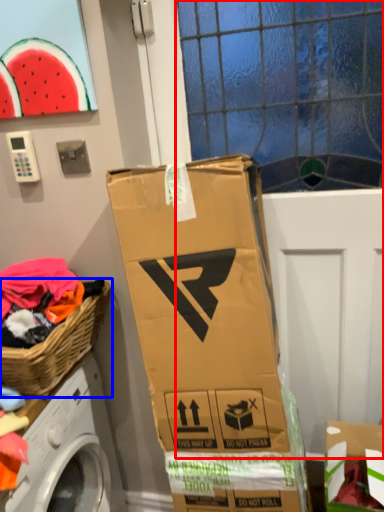
Question: Which of the following is the farthest to the observer, glass door (highlighted by a red box) or picnic basket (highlighted by a blue box)?

Choices:
 (A) glass door
 (B) picnic basket

Answer: (A)